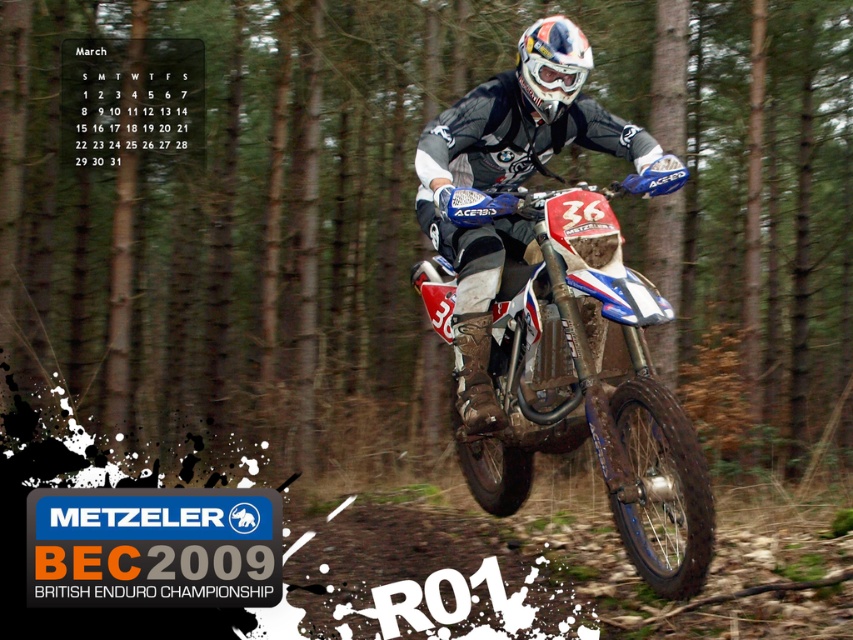
Question: Is white matte helmet at upper center thinner than white matte helmet at center?

Choices:
 (A) yes
 (B) no

Answer: (B)

Question: Which of the following is the closest to the observer?

Choices:
 (A) white matte helmet at center
 (B) white glossy motorbike at center
 (C) white matte helmet at upper center

Answer: (B)

Question: Is white glossy motorbike at center positioned at the back of white matte helmet at center?

Choices:
 (A) no
 (B) yes

Answer: (A)

Question: Which of the following is the farthest from the observer?

Choices:
 (A) white matte helmet at center
 (B) white glossy motorbike at center
 (C) white matte helmet at upper center

Answer: (C)

Question: Considering the real-world distances, which object is farthest from the white matte helmet at center?

Choices:
 (A) white glossy motorbike at center
 (B) white matte helmet at upper center

Answer: (A)

Question: Does white glossy motorbike at center have a smaller size compared to white matte helmet at upper center?

Choices:
 (A) no
 (B) yes

Answer: (A)